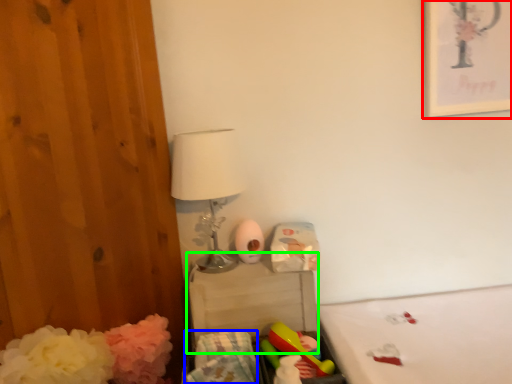
Question: Based on their relative distances, which object is farther from picture frame (highlighted by a red box)? Choose from material (highlighted by a blue box) and changing table (highlighted by a green box).

Choices:
 (A) material
 (B) changing table

Answer: (A)